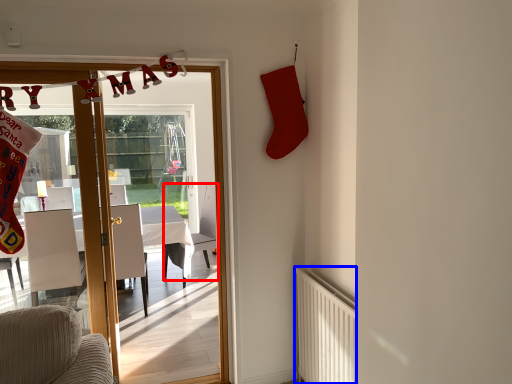
Question: Which object appears closest to the camera in this image, armchair (highlighted by a red box) or radiator (highlighted by a blue box)?

Choices:
 (A) armchair
 (B) radiator

Answer: (B)